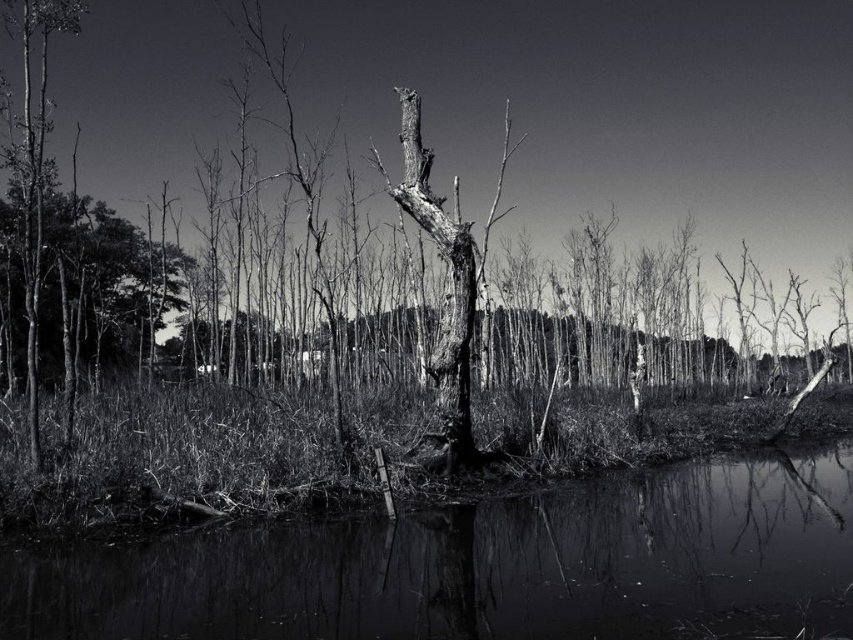
Which is behind, point (454, 276) or point (32, 356)?

Positioned behind is point (454, 276).

Can you confirm if smooth bark tree at center is bigger than smooth bark tree at left?

No.

Measure the distance between point [424,225] and camera.

45.13 feet

Where is `smooth bark tree at center`? The image size is (853, 640). smooth bark tree at center is located at coordinates (445, 278).

Is smooth water at center above smooth bark tree at left?

Incorrect, smooth water at center is not positioned above smooth bark tree at left.

Is point (48, 618) farther from camera compared to point (44, 161)?

That is False.

Is point (590, 493) closer to camera compared to point (68, 29)?

Yes, it is.

What are the coordinates of `smooth water at center` in the screenshot? It's located at (485, 566).

Who is more forward, (541,627) or (467,353)?

Point (541,627)

Does smooth water at center appear on the right side of smooth bark tree at center?

Indeed, smooth water at center is positioned on the right side of smooth bark tree at center.

The height and width of the screenshot is (640, 853). I want to click on smooth water at center, so click(485, 566).